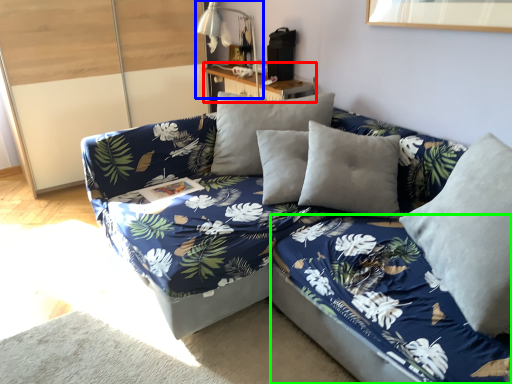
Question: Which object is the closest to the table (highlighted by a red box)? Choose among these: table lamp (highlighted by a blue box) or bed frame (highlighted by a green box).

Choices:
 (A) table lamp
 (B) bed frame

Answer: (A)